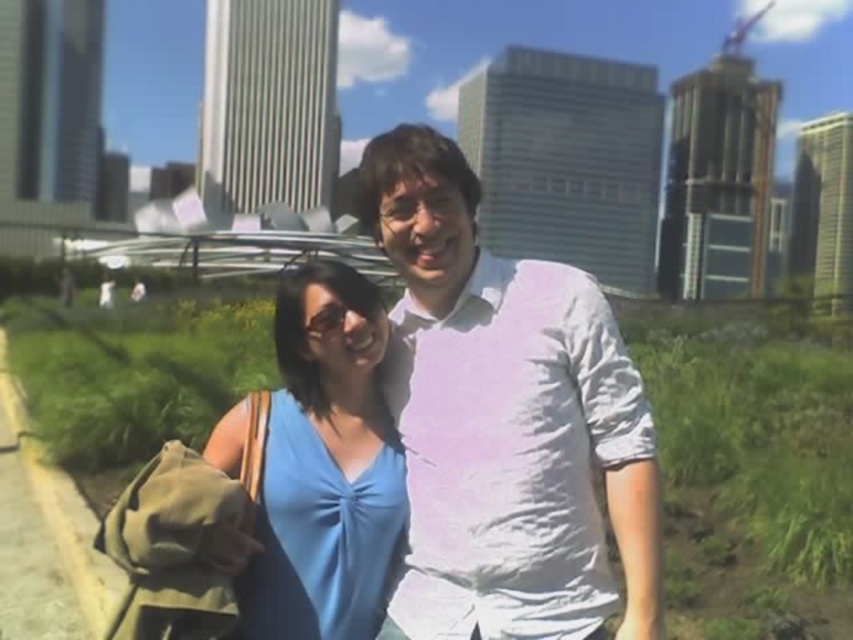
You are a photographer standing at the camera position. You want to take a photo of the white cotton shirt at center. Can you focus on it clearly without adjusting your camera settings?

The white cotton shirt at center is 1.46 meters away from the camera. Depending on the camera lens and focus range, it might be possible to focus clearly without adjustment. However, if the camera is set to a very shallow depth of field or macro mode, focusing might require adjustment. For general photography settings, it should be manageable.

You are a photographer trying to capture a clear shot of both the white cotton shirt at center and the blue fabric dress at center. Since you want both subjects to be visible, would adjusting your camera angle help ensure both are in focus?

The white cotton shirt at center is in front of the blue fabric dress at center. By adjusting the camera angle slightly to position both subjects side by side or ensuring the depth of field includes both, you can capture both in focus.